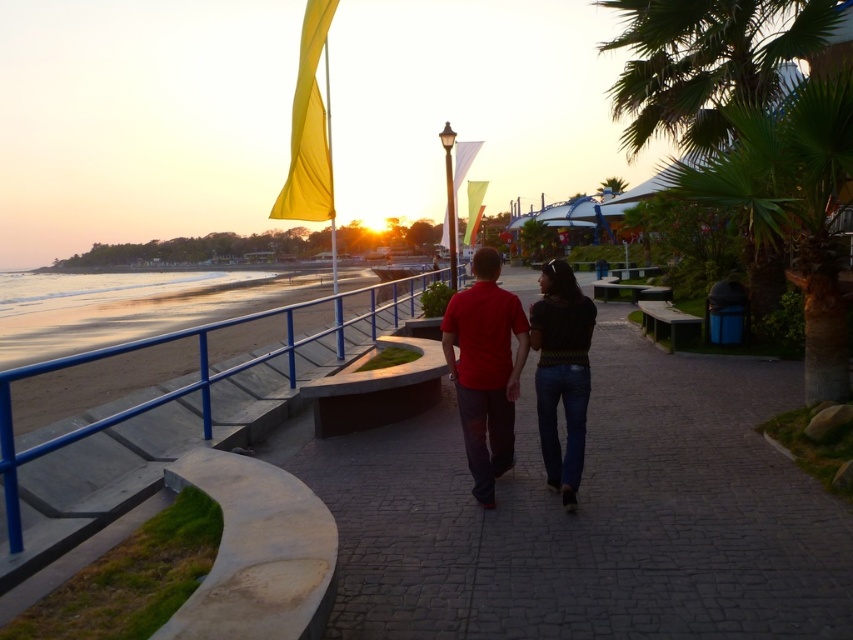
Does smooth concrete pavement at center have a smaller size compared to matte red shirt at center?

No, smooth concrete pavement at center is not smaller than matte red shirt at center.

Which is more to the left, smooth concrete pavement at center or matte red shirt at center?

Positioned to the left is matte red shirt at center.

Find the location of a particular element. smooth concrete pavement at center is located at coordinates click(x=593, y=516).

Locate an element on the screen. smooth concrete pavement at center is located at coordinates (593, 516).

Does green leafy palm tree at upper right come behind matte red shirt at center?

Yes, green leafy palm tree at upper right is behind matte red shirt at center.

This screenshot has height=640, width=853. Find the location of `green leafy palm tree at upper right`. green leafy palm tree at upper right is located at coordinates (750, 136).

Where is `green leafy palm tree at upper right`? Image resolution: width=853 pixels, height=640 pixels. green leafy palm tree at upper right is located at coordinates (750, 136).

Is point (590, 371) in front of point (561, 486)?

No, (590, 371) is behind (561, 486).

Between point (605, 490) and point (569, 378), which one is positioned behind?

The point (605, 490) is more distant.

Is point (457, 625) positioned after point (575, 298)?

No.

This screenshot has height=640, width=853. Find the location of `smooth concrete pavement at center`. smooth concrete pavement at center is located at coordinates (593, 516).